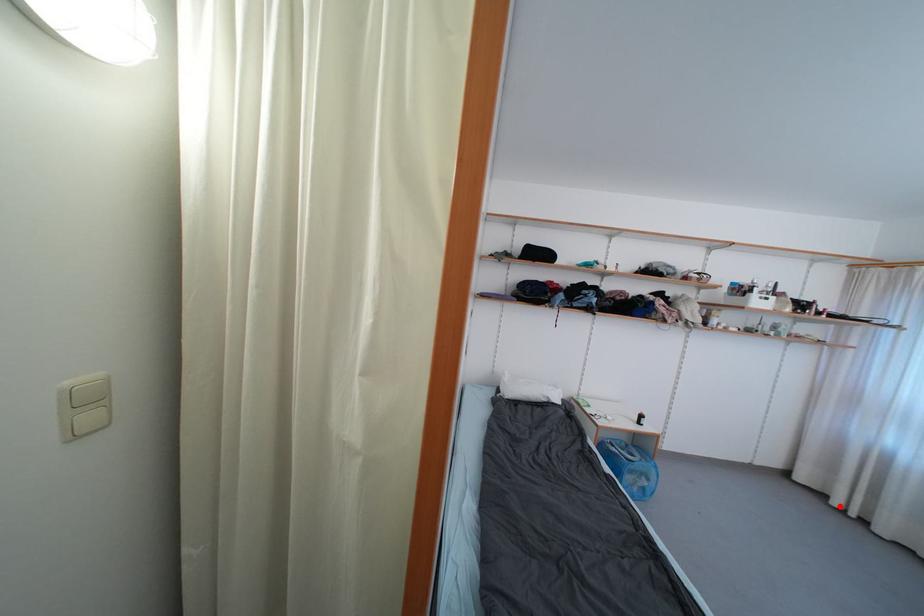
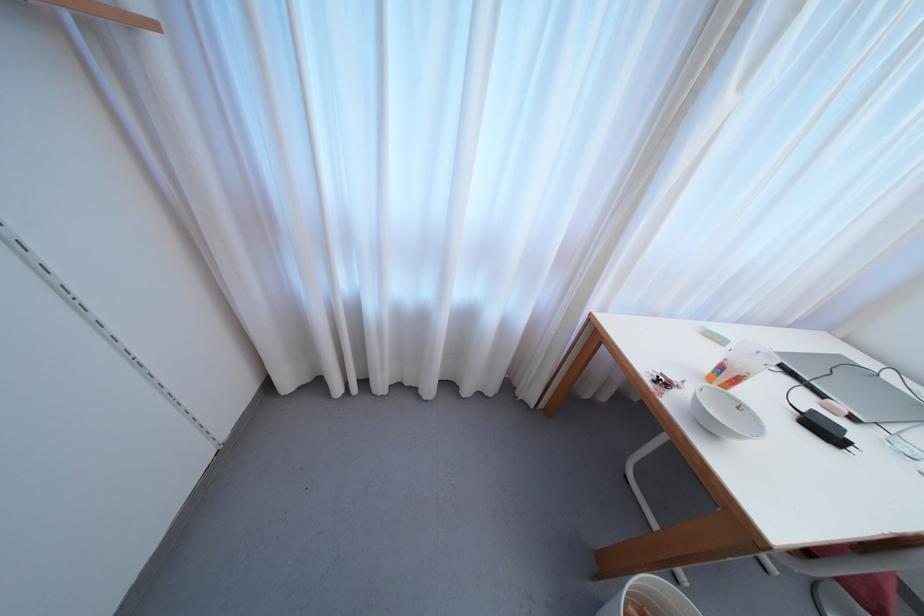
Question: I am providing you with two images of the same scene from different viewpoints. Given a red point in image1, look at the same physical point in image2. Is it:

Choices:
 (A) Closer to the viewpoint
 (B) Farther from the viewpoint

Answer: (B)